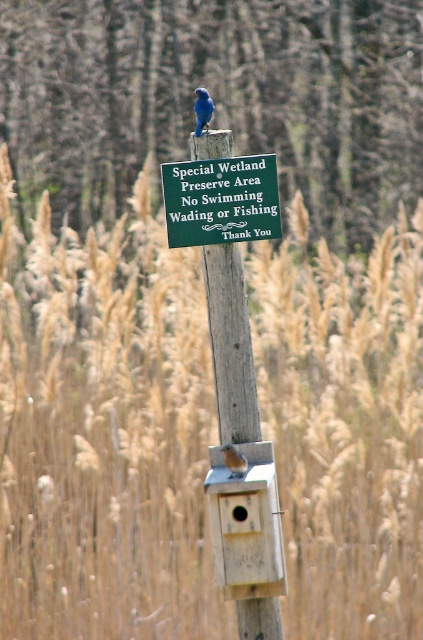
Question: Can you confirm if brown wood pole at center is wider than wooden post at center?

Choices:
 (A) yes
 (B) no

Answer: (A)

Question: Which point is farther from the camera taking this photo?

Choices:
 (A) (266, 552)
 (B) (260, 600)

Answer: (B)

Question: Does brown wood pole at center have a larger size compared to wooden post at center?

Choices:
 (A) no
 (B) yes

Answer: (B)

Question: Can you confirm if brown wood pole at center is positioned to the right of wooden bird feeder at center?

Choices:
 (A) no
 (B) yes

Answer: (A)

Question: Which point appears farthest from the camera in this image?

Choices:
 (A) (214, 547)
 (B) (230, 465)

Answer: (A)

Question: Which of the following is the farthest from the observer?

Choices:
 (A) wooden post at center
 (B) green wood sign at center
 (C) brown wood pole at center

Answer: (C)